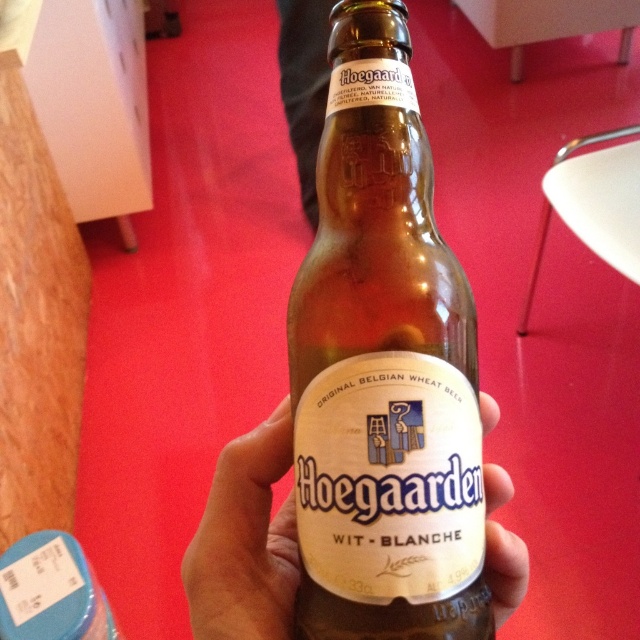
Measure the distance from brown glass bottle at center to clear glass bottle at center.

brown glass bottle at center and clear glass bottle at center are 32.24 inches apart.

Locate an element on the screen. This screenshot has width=640, height=640. brown glass bottle at center is located at coordinates (384, 392).

Find the location of a particular element. brown glass bottle at center is located at coordinates (384, 392).

Which is above, brown glass bottle at center or translucent glass bottle at center?

Positioned higher is brown glass bottle at center.

Is brown glass bottle at center taller than translucent glass bottle at center?

Correct, brown glass bottle at center is much taller as translucent glass bottle at center.

Is point (330, 205) in front of point (292, 604)?

Yes, point (330, 205) is in front of point (292, 604).

Locate an element on the screen. The width and height of the screenshot is (640, 640). brown glass bottle at center is located at coordinates (384, 392).

Is point (205, 564) positioned in front of point (45, 552)?

Yes, point (205, 564) is closer to viewer.

Which is below, translucent glass bottle at center or clear glass bottle at center?

clear glass bottle at center is lower down.

Does point (285, 428) come in front of point (74, 621)?

Yes, point (285, 428) is closer to viewer.

This screenshot has width=640, height=640. I want to click on translucent glass bottle at center, so click(x=244, y=541).